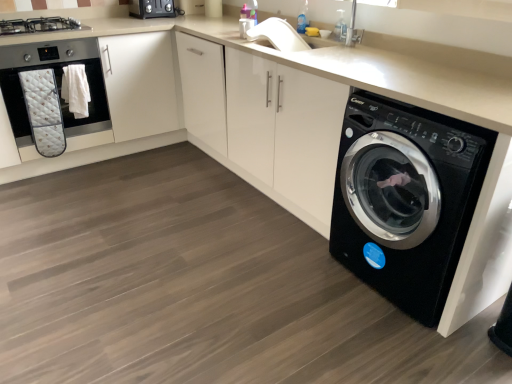
Question: In the image, is matte black oven at left positioned in front of or behind satin black toaster at upper center?

Choices:
 (A) front
 (B) behind

Answer: (A)

Question: From the image's perspective, is matte black oven at left located above or below satin black toaster at upper center?

Choices:
 (A) below
 (B) above

Answer: (A)

Question: Which of these objects is positioned farthest from the matte black oven at left?

Choices:
 (A) black glossy washing machine at lower right
 (B) satin black stove at upper left
 (C) satin black toaster at upper center

Answer: (A)

Question: Which object is the closest to the black glossy washing machine at lower right?

Choices:
 (A) satin black toaster at upper center
 (B) matte black oven at left
 (C) satin black stove at upper left

Answer: (B)